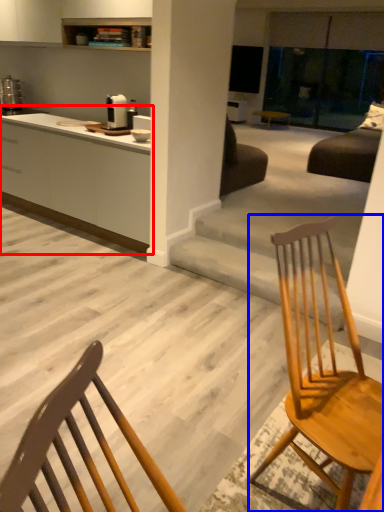
Question: Which object appears closest to the camera in this image, cabinetry (highlighted by a red box) or chair (highlighted by a blue box)?

Choices:
 (A) cabinetry
 (B) chair

Answer: (B)